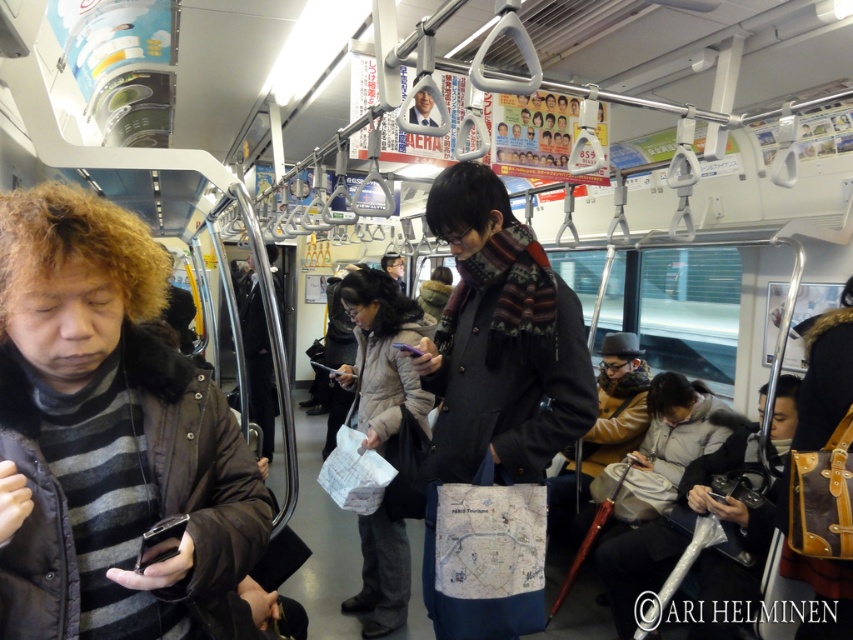
You are a passenger on the subway and you see a white paper map at center and a tan leather jacket at center. Which item takes up more space in the scene?

The white paper map at center has a larger size compared to the tan leather jacket at center, so it takes up more space in the scene.